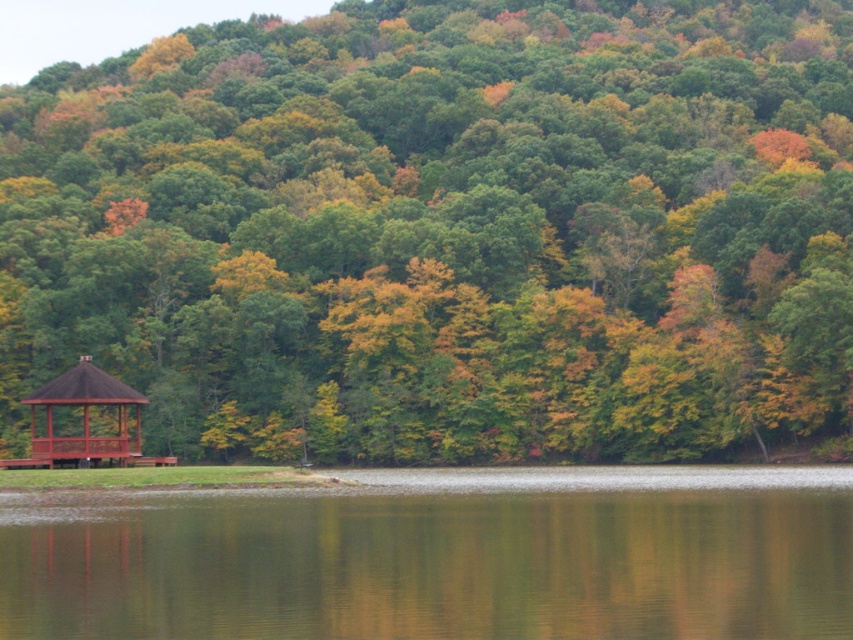
Is point (93, 337) farther from viewer compared to point (76, 378)?

Yes, it is.

Which is more to the left, green matte gazebo at lower left or brown wooden gazebo at left?

brown wooden gazebo at left

Which is in front, point (392, 83) or point (35, 401)?

Point (35, 401) is in front.

Locate an element on the screen. The width and height of the screenshot is (853, 640). green matte gazebo at lower left is located at coordinates (445, 230).

Measure the distance from green matte gazebo at lower left to green reflective water at lower center.

green matte gazebo at lower left is 228.84 feet from green reflective water at lower center.

Who is shorter, green matte gazebo at lower left or green reflective water at lower center?

green reflective water at lower center

Is point (4, 225) closer to viewer compared to point (556, 477)?

No, (4, 225) is further to viewer.

Locate an element on the screen. green matte gazebo at lower left is located at coordinates (445, 230).

Locate an element on the screen. green reflective water at lower center is located at coordinates (442, 556).

Can you confirm if green reflective water at lower center is shorter than brown wooden gazebo at left?

Correct, green reflective water at lower center is not as tall as brown wooden gazebo at left.

Looking at this image, who is more forward, [151,568] or [68,440]?

Point [151,568]

What are the coordinates of `green reflective water at lower center` in the screenshot? It's located at (442, 556).